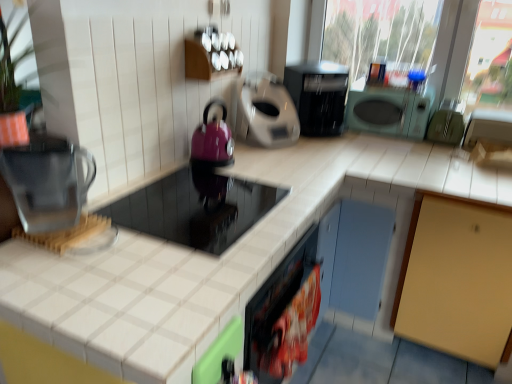
The width and height of the screenshot is (512, 384). I want to click on free space above shiny black cooktop at center, marked as the sixth appliance in a right-to-left arrangement (from a real-world perspective), so click(x=194, y=205).